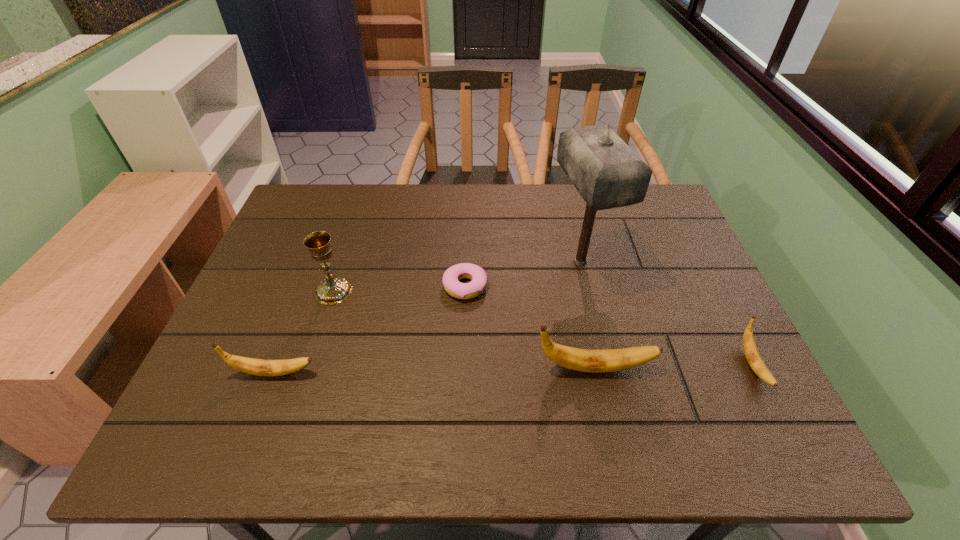
Image resolution: width=960 pixels, height=540 pixels. Identify the location of the second tallest banana. (261, 367).

The height and width of the screenshot is (540, 960). Find the location of `the fourth tallest object`. the fourth tallest object is located at coordinates (261, 367).

Identify the location of the fourth shortest object. The height and width of the screenshot is (540, 960). (585, 360).

This screenshot has height=540, width=960. I want to click on the second banana from left to right, so click(585, 360).

Find the location of a particular element. The image size is (960, 540). the rightmost banana is located at coordinates (753, 357).

I want to click on the rightmost object, so [x=753, y=357].

Locate an element on the screen. the third object from left to right is located at coordinates (451, 277).

Where is `the shortest object`? The image size is (960, 540). the shortest object is located at coordinates (451, 277).

You are a GUI agent. You are given a task and a screenshot of the screen. Output one action in this format:
    pyautogui.click(x=<x>, y=<y>)
    Task: Click on the tallest object
    The image size is (960, 540).
    Given the screenshot: What is the action you would take?
    pyautogui.click(x=607, y=173)

Where is `the second tallest object`? The width and height of the screenshot is (960, 540). the second tallest object is located at coordinates (334, 289).